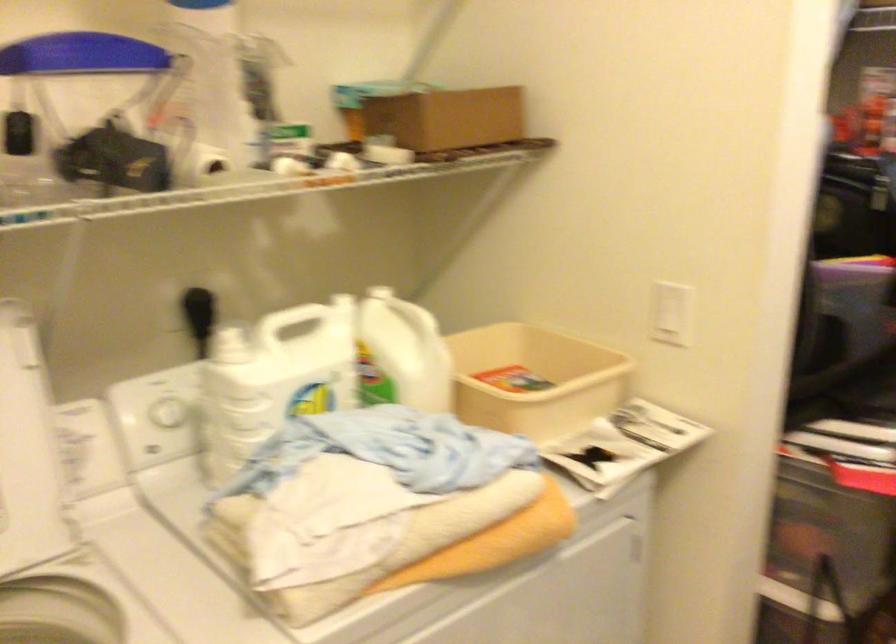
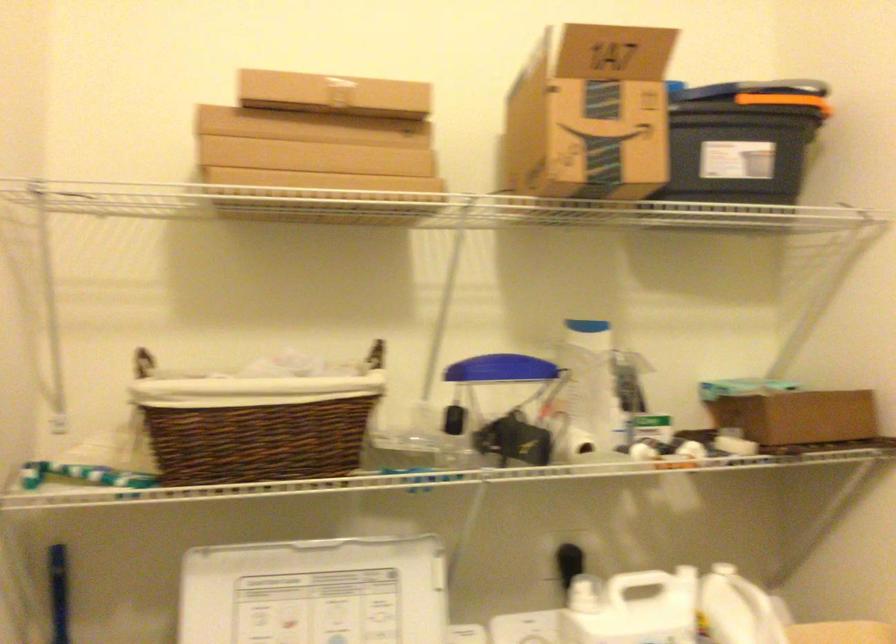
First-person continuous shooting, in which direction is the camera rotating?

The camera rotated toward left-up.